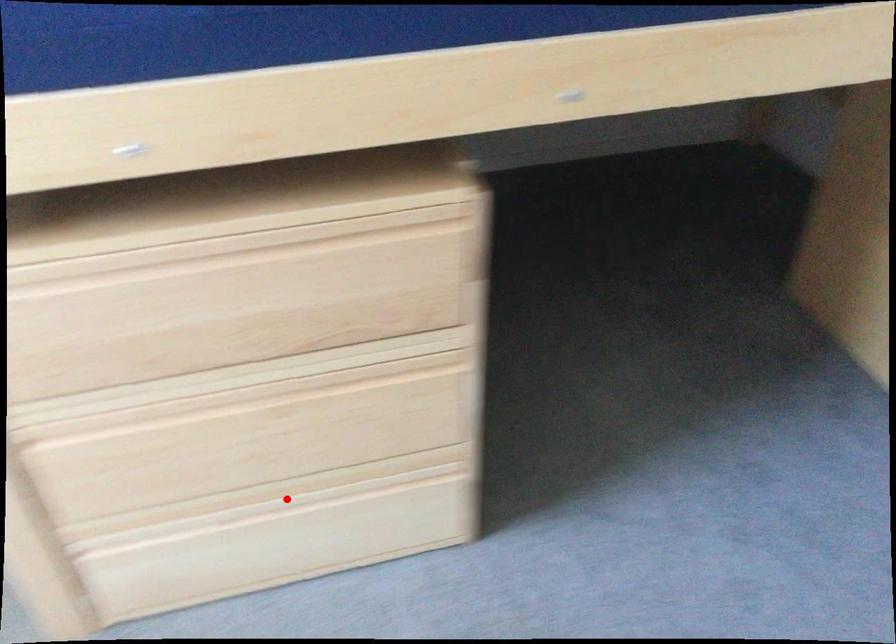
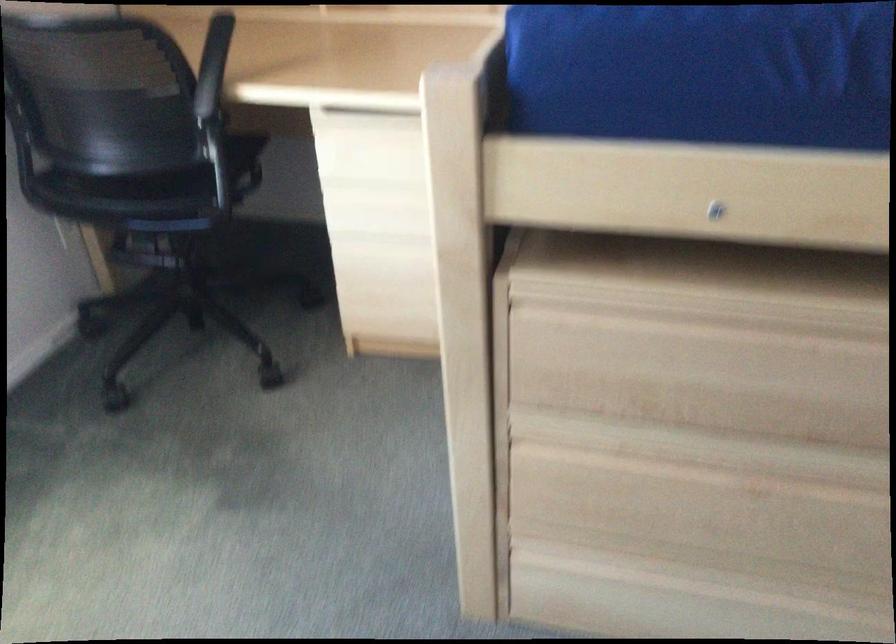
In the second image, find the point that corresponds to the highlighted location in the first image.

(705, 582)